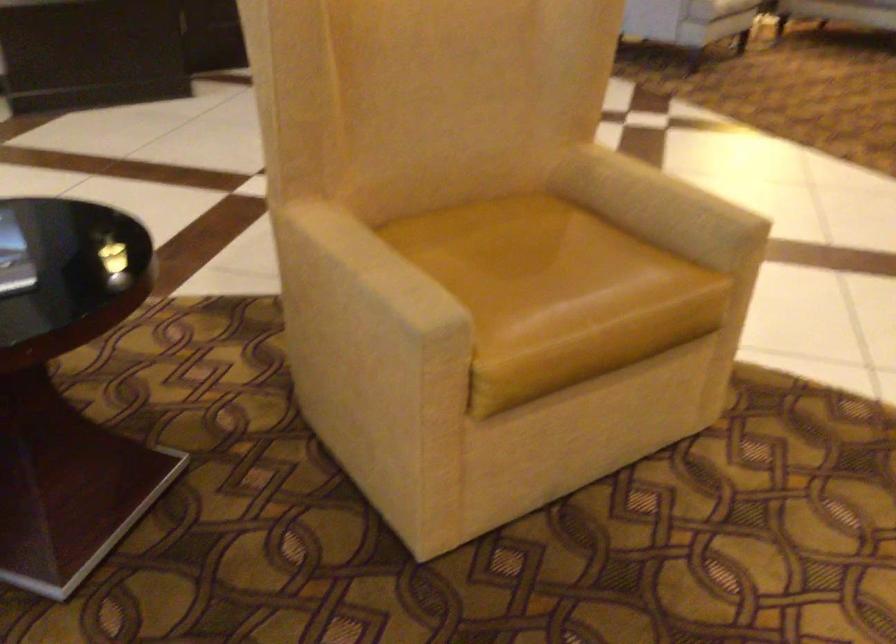
This screenshot has width=896, height=644. What do you see at coordinates (520, 256) in the screenshot?
I see `the yellow chair sitting surface` at bounding box center [520, 256].